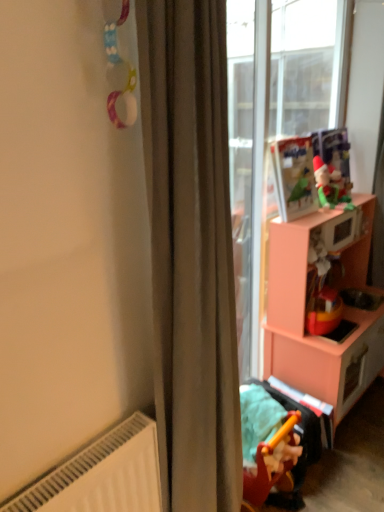
Question: Considering the positions of point (256, 490) and point (273, 226), is point (256, 490) closer or farther from the camera than point (273, 226)?

Choices:
 (A) closer
 (B) farther

Answer: (A)

Question: Is yellow plastic toy at lower right, marked as the second toy in a top-to-bottom arrangement, wider or thinner than pink matte cabinet at right?

Choices:
 (A) wide
 (B) thin

Answer: (B)

Question: Considering the real-world distances, which object is farthest from the matte plastic toy at upper right, which is the 2th toy in bottom-to-top order?

Choices:
 (A) yellow plastic toy at lower right, which is the second toy in right-to-left order
 (B) pink matte cabinet at right
 (C) satin beige curtain at center

Answer: (C)

Question: Estimate the real-world distances between objects in this image. Which object is closer to the matte plastic toy at upper right, arranged as the first toy when viewed from the right?

Choices:
 (A) pink matte cabinet at right
 (B) yellow plastic toy at lower right, the first toy positioned from the front
 (C) satin beige curtain at center

Answer: (A)